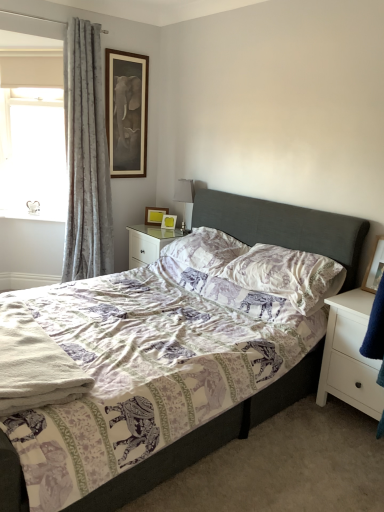
Question: Is matte wooden picture frame at upper center, which is the 4th picture frame in bottom-to-top order, in front of or behind purple printed pillow at center, arranged as the second pillow when viewed from the front, in the image?

Choices:
 (A) behind
 (B) front

Answer: (A)

Question: Do you think matte wooden picture frame at upper center, acting as the first picture frame starting from the top, is within purple printed pillow at center, arranged as the second pillow when viewed from the front, or outside of it?

Choices:
 (A) outside
 (B) inside

Answer: (A)

Question: Which is nearer to the wooden picture frame at upper center, the first picture frame positioned from the back?

Choices:
 (A) silver metallic table lamp at upper center
 (B) wooden picture frame at upper center, positioned as the 3th picture frame in front-to-back order
 (C) matte wooden picture frame at upper center, positioned as the second picture frame in front-to-back order
 (D) white matte nightstand at right, the 2th nightstand from the top
 (E) patterned fabric bed at center

Answer: (B)

Question: Which object is the closest to the patterned fabric bed at center?

Choices:
 (A) white glossy nightstand at center, which is counted as the second nightstand, starting from the bottom
 (B) printed fabric pillow at center, which is the 2th pillow in back-to-front order
 (C) wooden picture frame at right, arranged as the fourth picture frame when viewed from the top
 (D) gray velvet curtain at left
 (E) white soft towel at lower left

Answer: (B)